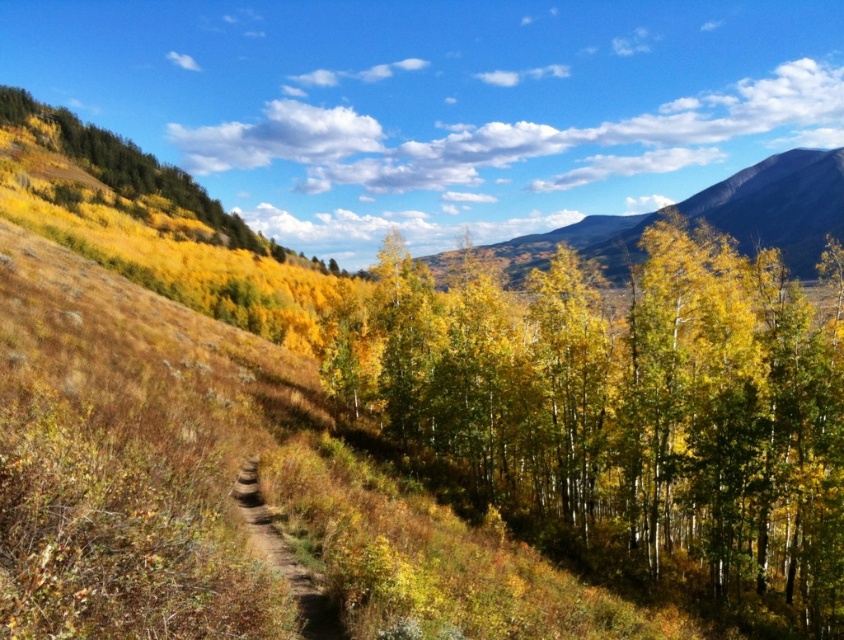
Question: Among these objects, which one is nearest to the camera?

Choices:
 (A) brown dirt path at center
 (B) yellow-green leaves at center

Answer: (A)

Question: Where is yellow-green leaves at center located in relation to brown dirt path at center in the image?

Choices:
 (A) below
 (B) above

Answer: (B)

Question: Which point is closer to the camera?

Choices:
 (A) (261, 531)
 (B) (766, 477)

Answer: (A)

Question: Can you confirm if yellow-green leaves at center is positioned below brown dirt path at center?

Choices:
 (A) no
 (B) yes

Answer: (A)

Question: Does yellow-green leaves at center appear over brown dirt path at center?

Choices:
 (A) yes
 (B) no

Answer: (A)